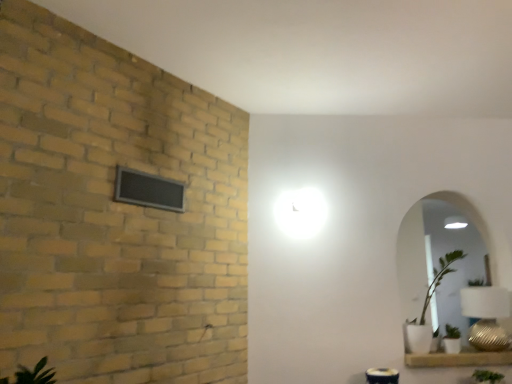
What is the approximate height of white ceramic window sill at lower right?

3.25 inches.

In order to face white ceramic window sill at lower right, should I rotate leftwards or rightwards?

Turn right approximately 25.415 degrees to face it.

The height and width of the screenshot is (384, 512). What do you see at coordinates (382, 376) in the screenshot?
I see `metallic silver table at lower right` at bounding box center [382, 376].

You are a GUI agent. You are given a task and a screenshot of the screen. Output one action in this format:
    pyautogui.click(x=<x>, y=<y>)
    Task: Click on the green leafy plant at lower right
    The height and width of the screenshot is (384, 512).
    Given the screenshot: What is the action you would take?
    pyautogui.click(x=487, y=376)

Measure the distance between point [413,239] and camera.

Point [413,239] is 3.18 meters away from camera.

Describe the element at coordinates (148, 190) in the screenshot. I see `black mesh window at upper left` at that location.

The height and width of the screenshot is (384, 512). I want to click on white ceramic window sill at lower right, so click(x=459, y=358).

Is gold textured table lamp at lower right facing towards white ceramic window sill at lower right?

No, gold textured table lamp at lower right is not facing towards white ceramic window sill at lower right.

In terms of size, does gold textured table lamp at lower right appear bigger or smaller than white ceramic window sill at lower right?

gold textured table lamp at lower right is bigger than white ceramic window sill at lower right.

Is white ceramic window sill at lower right surrounded by gold textured table lamp at lower right?

No, gold textured table lamp at lower right does not contain white ceramic window sill at lower right.

Is white glossy mirror at right placed right next to black mesh window at upper left?

No, white glossy mirror at right is not with black mesh window at upper left.

Considering the sizes of objects white glossy mirror at right and black mesh window at upper left in the image provided, who is wider, white glossy mirror at right or black mesh window at upper left?

With larger width is white glossy mirror at right.

From a real-world perspective, is black mesh window at upper left physically below metallic silver table at lower right?

Incorrect, from a real-world perspective, black mesh window at upper left is higher than metallic silver table at lower right.

Who is more distant, black mesh window at upper left or metallic silver table at lower right?

metallic silver table at lower right.

The image size is (512, 384). In order to click on window that appears on the left of metallic silver table at lower right in this screenshot , I will do `click(148, 190)`.

Is green leafy plant at lower right facing away from white ceramic window sill at lower right?

Yes.

What's the angular difference between green leafy plant at lower right and white ceramic window sill at lower right's facing directions?

The angular difference between green leafy plant at lower right and white ceramic window sill at lower right is 1.81 degrees.

Is green leafy plant at lower right not close to white ceramic window sill at lower right?

Actually, green leafy plant at lower right and white ceramic window sill at lower right are a little close together.

Where is `window sill on the left of green leafy plant at lower right`? This screenshot has height=384, width=512. window sill on the left of green leafy plant at lower right is located at coordinates (459, 358).

Based on the photo, is gold textured table lamp at lower right a part of white glossy mirror at right?

Yes, gold textured table lamp at lower right is a part of white glossy mirror at right.

Considering the relative sizes of white glossy mirror at right and gold textured table lamp at lower right in the image provided, is white glossy mirror at right shorter than gold textured table lamp at lower right?

In fact, white glossy mirror at right may be taller than gold textured table lamp at lower right.

From a real-world perspective, which is physically below, white glossy mirror at right or gold textured table lamp at lower right?

gold textured table lamp at lower right, from a real-world perspective.

You are a GUI agent. You are given a task and a screenshot of the screen. Output one action in this format:
    pyautogui.click(x=<x>, y=<y>)
    Task: Click on the table lamp in front of the white glossy mirror at right
    
    Given the screenshot: What is the action you would take?
    pyautogui.click(x=486, y=316)

Based on the photo, from a real-world perspective, is white ceramic window sill at lower right above or below black mesh window at upper left?

Clearly, from a real-world perspective, white ceramic window sill at lower right is below black mesh window at upper left.

From the image's perspective, between white ceramic window sill at lower right and black mesh window at upper left, who is located below?

white ceramic window sill at lower right is shown below in the image.

I want to click on window sill that appears below the black mesh window at upper left (from a real-world perspective), so click(x=459, y=358).

Do you think white ceramic window sill at lower right is within black mesh window at upper left, or outside of it?

white ceramic window sill at lower right cannot be found inside black mesh window at upper left.

Considering the relative sizes of white ceramic window sill at lower right and gold textured table lamp at lower right in the image provided, is white ceramic window sill at lower right taller than gold textured table lamp at lower right?

No.

Is point (471, 362) less distant than point (475, 345)?

Yes.

Can you confirm if white ceramic window sill at lower right is wider than gold textured table lamp at lower right?

Indeed, white ceramic window sill at lower right has a greater width compared to gold textured table lamp at lower right.

This screenshot has height=384, width=512. I want to click on table lamp above the white ceramic window sill at lower right (from the image's perspective), so click(486, 316).

You are a GUI agent. You are given a task and a screenshot of the screen. Output one action in this format:
    pyautogui.click(x=<x>, y=<y>)
    Task: Click on the mirror on the right of black mesh window at upper left
    The height and width of the screenshot is (384, 512).
    Given the screenshot: What is the action you would take?
    pyautogui.click(x=438, y=257)

From the image, which object appears to be nearer to white glossy mirror at right, green leafy plant at lower right or white ceramic window sill at lower right?

white ceramic window sill at lower right is closer to white glossy mirror at right.

In the scene shown: Estimate the real-world distances between objects in this image. Which object is closer to black mesh window at upper left, white glossy mirror at right or green leafy plant at lower right?

white glossy mirror at right.

Estimate the real-world distances between objects in this image. Which object is closer to white ceramic window sill at lower right, black mesh window at upper left or white glossy mirror at right?

white glossy mirror at right is positioned closer to the anchor white ceramic window sill at lower right.

From the image, which object appears to be nearer to white ceramic window sill at lower right, green leafy plant at lower right or gold textured table lamp at lower right?

green leafy plant at lower right is positioned closer to the anchor white ceramic window sill at lower right.

Which object lies further to the anchor point white glossy mirror at right, metallic silver table at lower right or black mesh window at upper left?

black mesh window at upper left is positioned further to the anchor white glossy mirror at right.

Looking at the image, which one is located further to gold textured table lamp at lower right, black mesh window at upper left or green leafy plant at lower right?

black mesh window at upper left is further to gold textured table lamp at lower right.

Which object lies nearer to the anchor point gold textured table lamp at lower right, black mesh window at upper left or white glossy mirror at right?

white glossy mirror at right is closer to gold textured table lamp at lower right.

Based on their spatial positions, is black mesh window at upper left or metallic silver table at lower right closer to white ceramic window sill at lower right?

metallic silver table at lower right is positioned closer to the anchor white ceramic window sill at lower right.

This screenshot has height=384, width=512. I want to click on window sill between black mesh window at upper left and green leafy plant at lower right from left to right, so click(459, 358).

Where is `mirror located between black mesh window at upper left and green leafy plant at lower right in the left-right direction`? The height and width of the screenshot is (384, 512). mirror located between black mesh window at upper left and green leafy plant at lower right in the left-right direction is located at coordinates (438, 257).

You are a GUI agent. You are given a task and a screenshot of the screen. Output one action in this format:
    pyautogui.click(x=<x>, y=<y>)
    Task: Click on the plant between metallic silver table at lower right and gold textured table lamp at lower right from left to right
    The height and width of the screenshot is (384, 512).
    Given the screenshot: What is the action you would take?
    pyautogui.click(x=487, y=376)

This screenshot has width=512, height=384. Identify the location of table between black mesh window at upper left and white ceramic window sill at lower right from left to right. (382, 376).